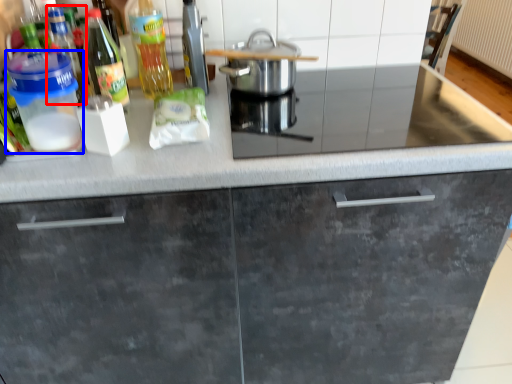
Question: Which object appears farthest to the camera in this image, bottle (highlighted by a red box) or kitchen appliance (highlighted by a blue box)?

Choices:
 (A) bottle
 (B) kitchen appliance

Answer: (A)